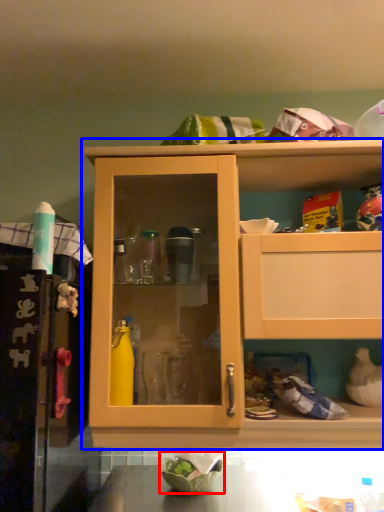
Question: Which point is closer to the camera, bowl (highlighted by a red box) or cabinetry (highlighted by a blue box)?

Choices:
 (A) bowl
 (B) cabinetry

Answer: (B)